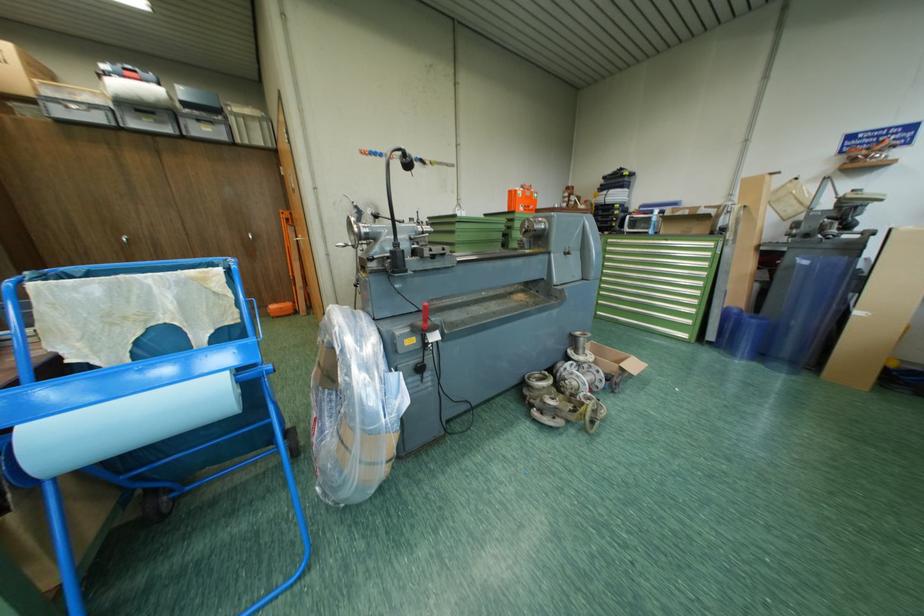
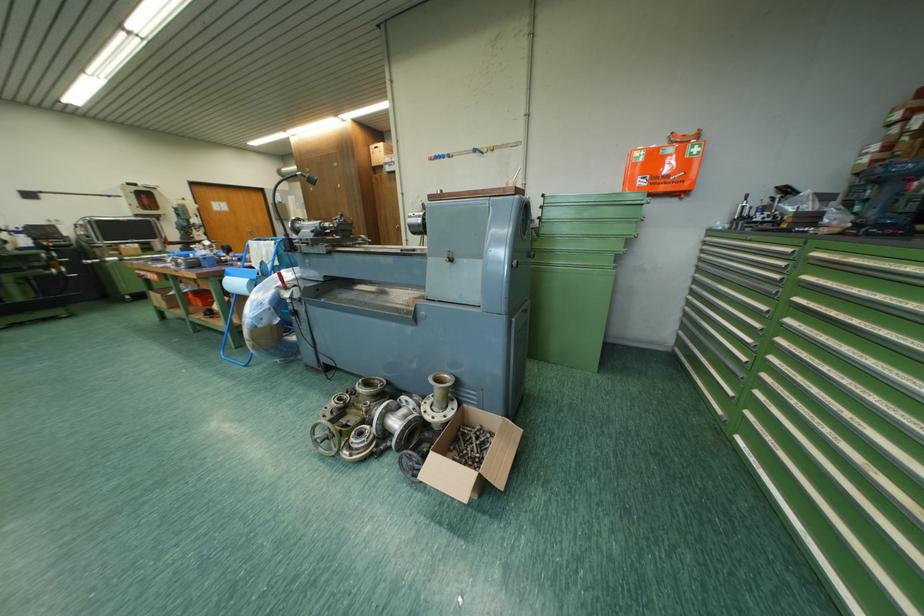
Locate, in the second image, the point that corresponds to point 560,456 in the first image.

(311, 428)